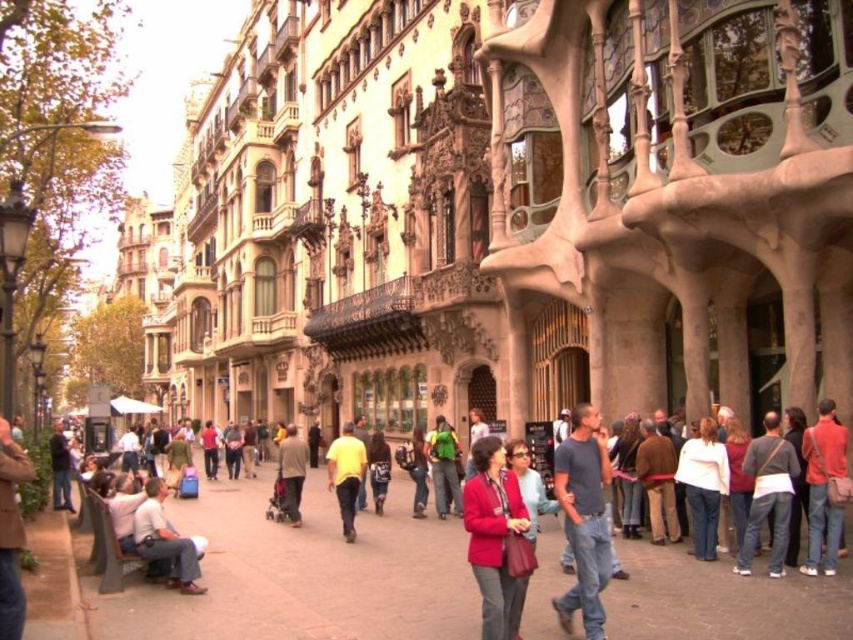
You are a photographer standing on the bustling urban street scene in front of the Gaudian building. You notice two people wearing an orange fabric shirt at lower right and a light brown fabric jacket at center. Which clothing item is taller?

The orange fabric shirt at lower right is taller than the light brown fabric jacket at center according to the description.

You are a photographer standing on the street in front of the Gaudian building. You want to take a photo that includes both the orange fabric shirt at lower right and the light brown fabric jacket at center. The minimum distance between them is 40.56 meters. Can you fit both subjects into a single frame without moving your position?

The orange fabric shirt at lower right and light brown fabric jacket at center are 40.56 meters apart. Since they are 40.56 meters away from each other, it is possible to fit both into a single frame if your camera has a wide enough angle or zoom level to capture that distance without moving your position.

You are a street performer who needs to decide which item to place on a small stand. The stand can only hold one item. Given the light brown leather jacket at lower left and the green fabric backpack at center, which item would you choose based on their sizes?

The light brown leather jacket at lower left is larger in size than the green fabric backpack at center, so you should choose the green fabric backpack at center to place on the small stand since it is smaller and fits better.